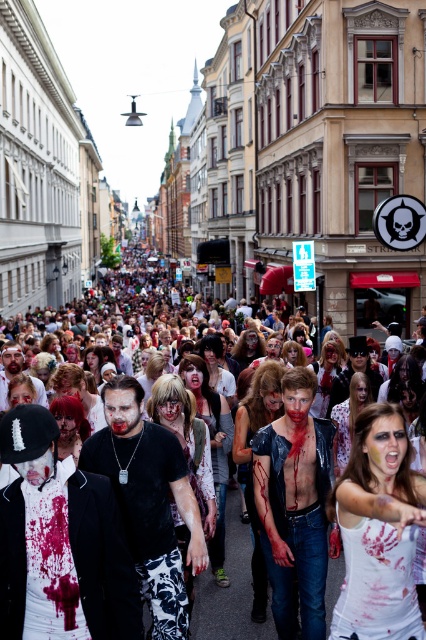
Is blood-stained costumes at center wider than white matte tank top at lower right?

Indeed, blood-stained costumes at center has a greater width compared to white matte tank top at lower right.

Can you confirm if blood-stained costumes at center is positioned below white matte tank top at lower right?

Incorrect, blood-stained costumes at center is not positioned below white matte tank top at lower right.

Between point (175, 323) and point (356, 547), which one is positioned behind?

Point (175, 323)

In order to click on blood-stained costumes at center in this screenshot , I will do `click(111, 316)`.

Does white matte suit at center have a lesser height compared to white matte tank top at lower right?

Incorrect, white matte suit at center's height does not fall short of white matte tank top at lower right's.

Does white matte suit at center have a smaller size compared to white matte tank top at lower right?

Incorrect, white matte suit at center is not smaller in size than white matte tank top at lower right.

Is point (83, 554) positioned in front of point (330, 634)?

Yes, point (83, 554) is in front of point (330, 634).

The image size is (426, 640). Identify the location of white matte suit at center. (103, 560).

Which is more to the left, blood-stained costumes at center or white matte suit at center?

From the viewer's perspective, blood-stained costumes at center appears more on the left side.

Does blood-stained costumes at center appear on the left side of white matte suit at center?

Indeed, blood-stained costumes at center is positioned on the left side of white matte suit at center.

Image resolution: width=426 pixels, height=640 pixels. Describe the element at coordinates (111, 316) in the screenshot. I see `blood-stained costumes at center` at that location.

What are the coordinates of `blood-stained costumes at center` in the screenshot? It's located at (111, 316).